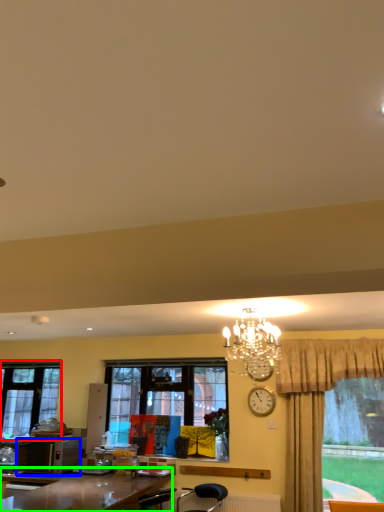
Question: Which object is positioned closest to window (highlighted by a red box)? Select from microwave oven (highlighted by a blue box) and desk (highlighted by a green box).

Choices:
 (A) microwave oven
 (B) desk

Answer: (A)